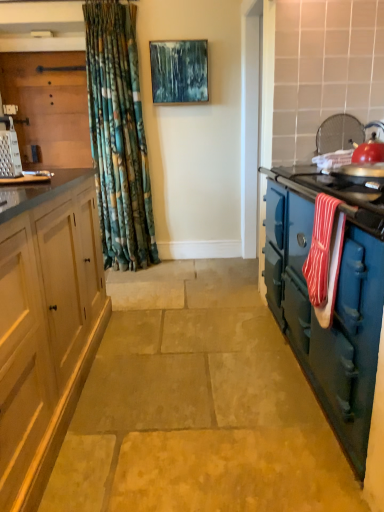
From the picture: What is the approximate height of metallic silver grater at left?

metallic silver grater at left is 24.91 centimeters in height.

Describe the element at coordinates (9, 150) in the screenshot. I see `metallic silver grater at left` at that location.

Locate an element on the screen. This screenshot has width=384, height=512. natural stone floor at center is located at coordinates (198, 422).

What is the approximate height of brushed metal grater at left, which is counted as the 2th cabinetry, starting from the front?

The height of brushed metal grater at left, which is counted as the 2th cabinetry, starting from the front, is 3.83 feet.

This screenshot has height=512, width=384. Describe the element at coordinates (320, 249) in the screenshot. I see `red striped towel at right` at that location.

Identify the location of metallic silver grater at left. (9, 150).

Are metallic silver grater at left and textured canvas painting at upper center far apart?

That's right, there is a large distance between metallic silver grater at left and textured canvas painting at upper center.

Is metallic silver grater at left wider than textured canvas painting at upper center?

Yes, metallic silver grater at left is wider than textured canvas painting at upper center.

Identify the location of picture frame on the right of metallic silver grater at left. (179, 71).

From a real-world perspective, who is located lower, brushed metal grater at left, arranged as the 1th cabinetry when viewed from the back, or natural stone floor at center?

From a 3D spatial view, natural stone floor at center is below.

Considering the relative sizes of brushed metal grater at left, which is counted as the 2th cabinetry, starting from the front, and natural stone floor at center in the image provided, is brushed metal grater at left, which is counted as the 2th cabinetry, starting from the front, smaller than natural stone floor at center?

Indeed, brushed metal grater at left, which is counted as the 2th cabinetry, starting from the front, has a smaller size compared to natural stone floor at center.

How many degrees apart are the facing directions of brushed metal grater at left, placed as the second cabinetry when sorted from bottom to top, and natural stone floor at center?

The facing directions of brushed metal grater at left, placed as the second cabinetry when sorted from bottom to top, and natural stone floor at center are 89.1 degrees apart.

Is natural stone floor at center at the back of brushed metal grater at left, which is counted as the 2th cabinetry, starting from the front?

No, brushed metal grater at left, which is counted as the 2th cabinetry, starting from the front, is not facing away from natural stone floor at center.

From a real-world perspective, between brushed metal grater at left, which ranks as the second cabinetry in right-to-left order, and red striped towel at right, who is vertically lower?

In real-world perspective, red striped towel at right is lower.

Is red striped towel at right at the back of brushed metal grater at left, which is counted as the 2th cabinetry, starting from the front?

No, brushed metal grater at left, which is counted as the 2th cabinetry, starting from the front, is not facing away from red striped towel at right.

Choose the correct answer: Is brushed metal grater at left, placed as the second cabinetry when sorted from bottom to top, inside red striped towel at right or outside it?

brushed metal grater at left, placed as the second cabinetry when sorted from bottom to top, is not inside red striped towel at right, it's outside.

Which of these two, brushed metal grater at left, which is counted as the 2th cabinetry, starting from the front, or red striped towel at right, is thinner?

red striped towel at right is thinner.

In the scene shown: Would you say textured canvas painting at upper center is inside or outside red striped towel at right?

textured canvas painting at upper center is not inside red striped towel at right, it's outside.

Which object is further away from the camera, textured canvas painting at upper center or red striped towel at right?

textured canvas painting at upper center is more distant.

Between textured canvas painting at upper center and red striped towel at right, which one appears on the right side from the viewer's perspective?

red striped towel at right.

From a real-world perspective, which object stands above the other?

textured canvas painting at upper center.

From a real-world perspective, is natural stone floor at center over brushed metal grater at left, which is counted as the 2th cabinetry, starting from the front?

No.

Between natural stone floor at center and brushed metal grater at left, placed as the 1th cabinetry when sorted from top to bottom, which one has more height?

brushed metal grater at left, placed as the 1th cabinetry when sorted from top to bottom, is taller.

Is brushed metal grater at left, which is the 1th cabinetry in left-to-right order, a part of natural stone floor at center?

No, brushed metal grater at left, which is the 1th cabinetry in left-to-right order, is located outside of natural stone floor at center.

Which object is more forward, textured canvas painting at upper center or natural stone floor at center?

natural stone floor at center is closer to the camera.

Consider the image. Which is correct: textured canvas painting at upper center is inside natural stone floor at center, or outside of it?

textured canvas painting at upper center is located beyond the bounds of natural stone floor at center.

Does textured canvas painting at upper center have a smaller size compared to natural stone floor at center?

Yes.

Is textured canvas painting at upper center beside natural stone floor at center?

textured canvas painting at upper center and natural stone floor at center are not in contact.

Can you confirm if metallic silver grater at left is taller than natural stone floor at center?

Yes, metallic silver grater at left is taller than natural stone floor at center.

Is metallic silver grater at left situated inside natural stone floor at center or outside?

metallic silver grater at left lies outside natural stone floor at center.

From a real-world perspective, is metallic silver grater at left positioned above or below natural stone floor at center?

From a real-world perspective, metallic silver grater at left is physically above natural stone floor at center.

Can you confirm if metallic silver grater at left is positioned to the right of natural stone floor at center?

No.

This screenshot has width=384, height=512. I want to click on picture frame above the metallic silver grater at left (from a real-world perspective), so pyautogui.click(x=179, y=71).

Identify the location of cabinetry behind the natural stone floor at center. (49, 106).

Which object lies nearer to the anchor point blue cast iron stove at right, the second cabinetry positioned from the top, brushed metal grater at left, which is counted as the 2th cabinetry, starting from the front, or metallic silver grater at left?

metallic silver grater at left is positioned closer to the anchor blue cast iron stove at right, the second cabinetry positioned from the top.

Looking at the image, which one is located further to brushed metal grater at left, which ranks as the second cabinetry in right-to-left order, textured canvas painting at upper center or red striped towel at right?

red striped towel at right is further to brushed metal grater at left, which ranks as the second cabinetry in right-to-left order.

When comparing their distances from textured canvas painting at upper center, does brushed metal grater at left, which is counted as the 2th cabinetry, starting from the front, or natural stone floor at center seem closer?

brushed metal grater at left, which is counted as the 2th cabinetry, starting from the front.

When comparing their distances from natural stone floor at center, does brushed metal grater at left, arranged as the 1th cabinetry when viewed from the back, or red striped towel at right seem further?

brushed metal grater at left, arranged as the 1th cabinetry when viewed from the back, is further to natural stone floor at center.

Based on their spatial positions, is natural stone floor at center or brushed metal grater at left, arranged as the 1th cabinetry when viewed from the back, closer to blue cast iron stove at right, the second cabinetry positioned from the top?

natural stone floor at center is closer to blue cast iron stove at right, the second cabinetry positioned from the top.

Which object lies nearer to the anchor point natural stone floor at center, textured canvas painting at upper center or brushed metal grater at left, which is counted as the 2th cabinetry, starting from the front?

Among the two, textured canvas painting at upper center is located nearer to natural stone floor at center.

Which object lies further to the anchor point natural stone floor at center, brushed metal grater at left, arranged as the 1th cabinetry when viewed from the back, or textured canvas painting at upper center?

brushed metal grater at left, arranged as the 1th cabinetry when viewed from the back, is further to natural stone floor at center.

When comparing their distances from blue cast iron stove at right, the first cabinetry from the bottom, does red striped towel at right or textured canvas painting at upper center seem further?

textured canvas painting at upper center is further to blue cast iron stove at right, the first cabinetry from the bottom.

The width and height of the screenshot is (384, 512). In order to click on kitchen appliance between blue cast iron stove at right, which is the 1th cabinetry in right-to-left order, and brushed metal grater at left, which ranks as the second cabinetry in right-to-left order, in the front-back direction in this screenshot , I will do `click(9, 150)`.

The width and height of the screenshot is (384, 512). Identify the location of kitchen appliance between blue cast iron stove at right, the second cabinetry positioned from the top, and textured canvas painting at upper center, along the z-axis. (9, 150).

Find the location of a particular element. This screenshot has height=512, width=384. concrete positioned between blue cast iron stove at right, the first cabinetry from the bottom, and textured canvas painting at upper center from near to far is located at coordinates (198, 422).

Image resolution: width=384 pixels, height=512 pixels. What are the coordinates of `concrete between blue cast iron stove at right, the 1th cabinetry when ordered from front to back, and brushed metal grater at left, arranged as the 1th cabinetry when viewed from the back, from front to back` in the screenshot? It's located at (198, 422).